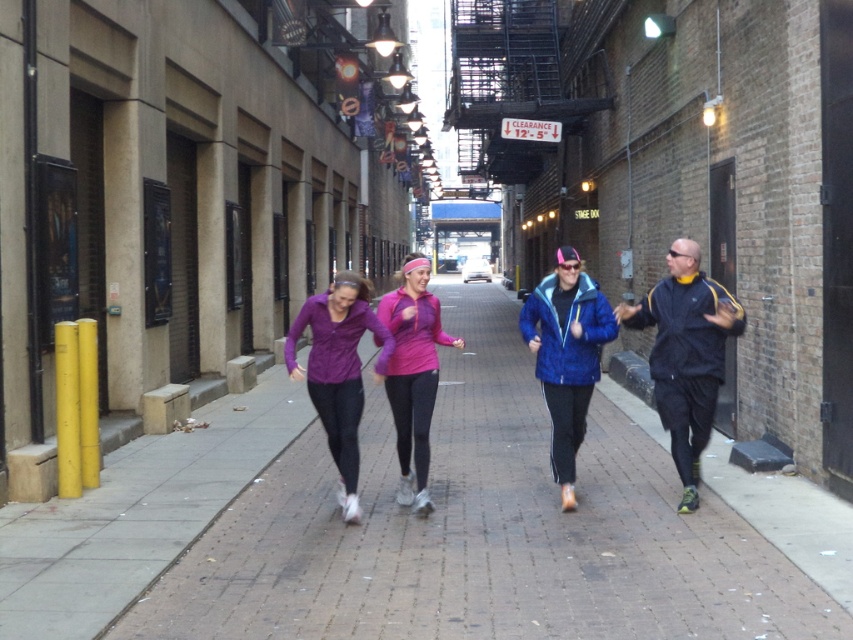
You are a delivery person who needs to place a large package on the ground. The package is the size of the dark blue track suit at right. Is there enough space on the brick pavement at center to place it without overlapping anything?

The brick pavement at center is bigger than the dark blue track suit at right, so yes, there is enough space to place the package without overlapping anything.

You are a delivery drone flying above the alleyway. You need to land on the brick pavement at center to drop off a package. What are the coordinates where you should aim to land?

The brick pavement at center is located at coordinates point (418, 525), so you should aim for that point to land.

Based on the photo, you are a delivery person who needs to deliver a package that requires a minimum clearance of 12 feet 5 inches. You see the brick pavement at center. Can you safely pass through the alleyway without hitting the clearance sign?

The clearance sign states 12 feet 5 inches, and the distance between the brick pavement at center and the sign is 14.70 feet. Since the required clearance is met, you can safely pass through the alleyway without hitting the sign.